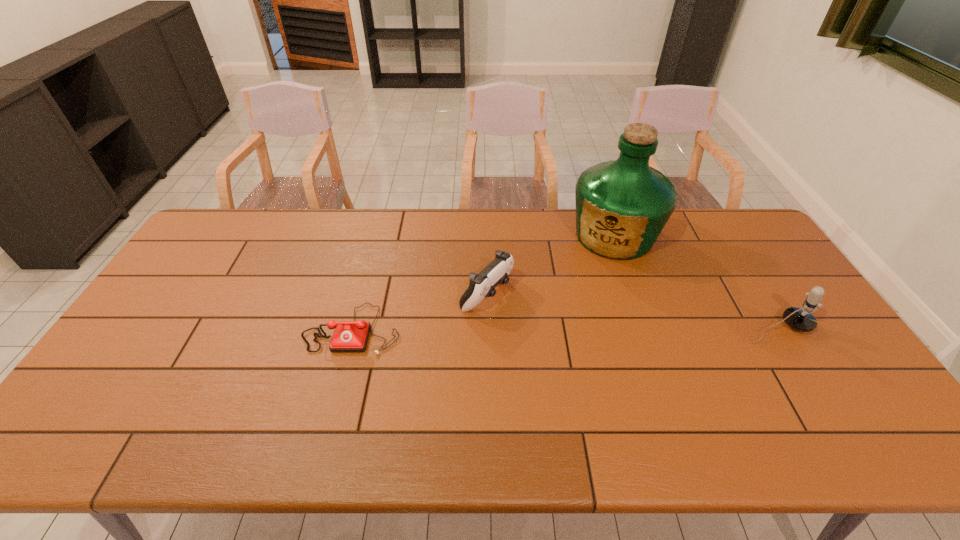
Where is `the leftmost object`? This screenshot has width=960, height=540. the leftmost object is located at coordinates (349, 336).

The image size is (960, 540). Find the location of `the shortest object`. the shortest object is located at coordinates (349, 336).

Locate an element on the screen. This screenshot has width=960, height=540. microphone is located at coordinates (799, 319).

At what (x,y) coordinates should I click in order to perform the action: click on the third tallest object. Please return your answer as a coordinate pair (x, y). The image size is (960, 540). Looking at the image, I should click on (481, 285).

At what (x,y) coordinates should I click in order to perform the action: click on control. Please return your answer as a coordinate pair (x, y). Image resolution: width=960 pixels, height=540 pixels. Looking at the image, I should click on (481, 285).

Locate an element on the screen. The height and width of the screenshot is (540, 960). liquor is located at coordinates (622, 206).

Where is `the third object from left to right`? The height and width of the screenshot is (540, 960). the third object from left to right is located at coordinates (622, 206).

The image size is (960, 540). I want to click on vacant space situated 0.120m on the dial of the telephone, so pos(335,397).

The height and width of the screenshot is (540, 960). I want to click on free space located on the left of the microphone, so click(x=705, y=328).

Locate an element on the screen. This screenshot has height=540, width=960. vacant space situated 0.340m on the front-facing side of the third tallest object is located at coordinates (617, 368).